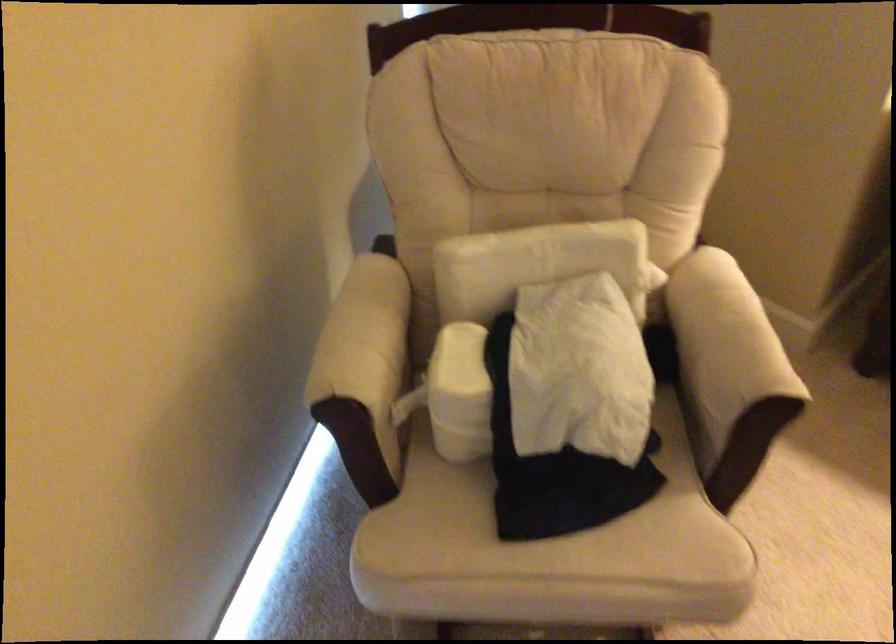
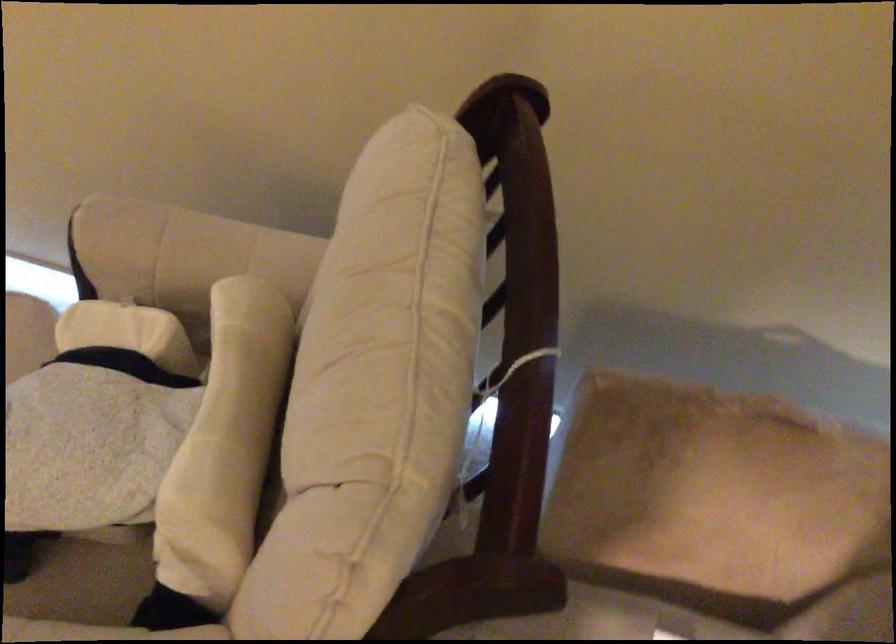
Find the pixel in the second image that matches (x=636, y=430) in the first image.

(82, 583)